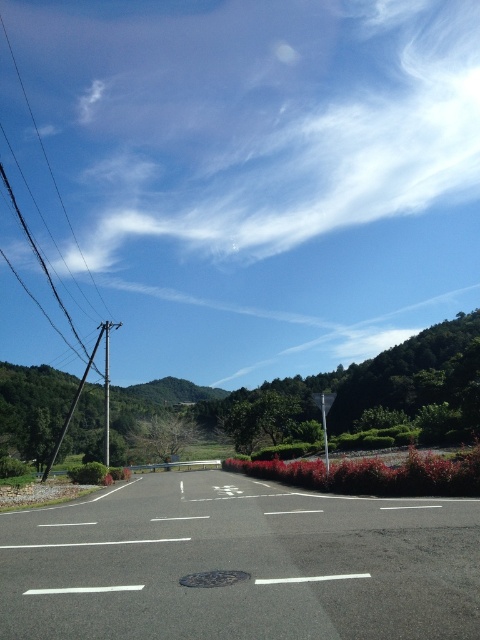
You are a painter standing at the bottom center of the road, near the manhole cover. You want to paint the metallic pole at left and the metallic wire at left. Which object should you paint first if you want to paint the one closer to you first?

The metallic wire at left is closer to you than the metallic pole at left, so you should paint the metallic wire at left first.

You are a delivery driver approaching the road shown in the image. You notice the metallic wire at left and the metallic pole at left from your viewpoint. Which object would you see first as you drive along the road?

The metallic wire at left is to the left of the metallic pole at left, so you would see the metallic wire at left first as you drive along the road.